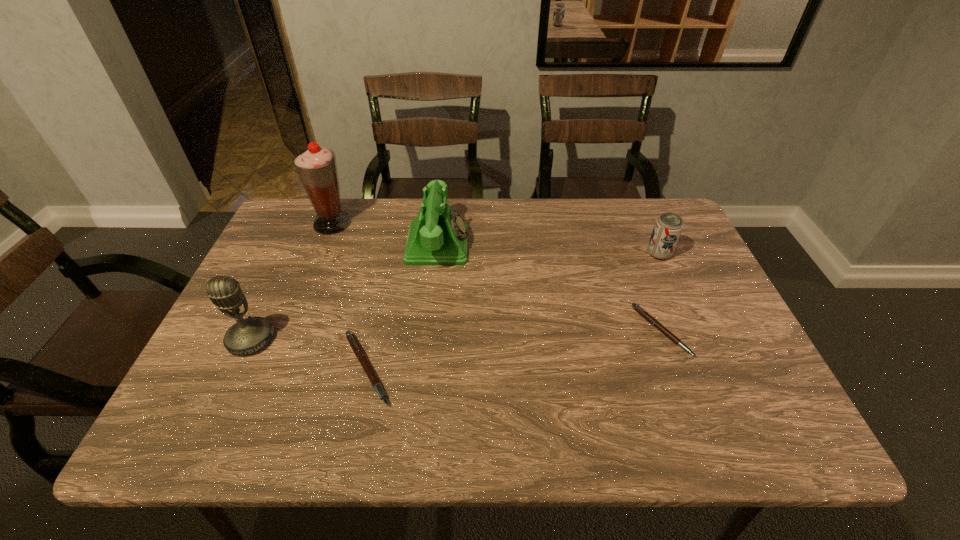
Identify which object is the second nearest to the left pen. Please provide its 2D coordinates. Your answer should be formatted as a tuple, i.e. [(x, y)], where the tuple contains the x and y coordinates of a point satisfying the conditions above.

[(437, 236)]

At what (x,y) coordinates should I click in order to perform the action: click on vacant position in the image that satisfies the following two spatial constraints: 1. on the dial of the telephone; 2. on the front-facing side of the microphone. Please return your answer as a coordinate pair (x, y). This screenshot has width=960, height=540. Looking at the image, I should click on (428, 340).

Identify the location of free location that satisfies the following two spatial constraints: 1. on the front side of the beer can; 2. at the nib of the second shortest object. This screenshot has height=540, width=960. (709, 369).

This screenshot has width=960, height=540. Find the location of `free space that satisfies the following two spatial constraints: 1. on the dial of the telephone; 2. on the front-facing side of the microphone`. free space that satisfies the following two spatial constraints: 1. on the dial of the telephone; 2. on the front-facing side of the microphone is located at coordinates (428, 340).

Locate an element on the screen. vacant space that satisfies the following two spatial constraints: 1. on the dial of the third tallest object; 2. on the right side of the beer can is located at coordinates (437, 254).

You are a GUI agent. You are given a task and a screenshot of the screen. Output one action in this format:
    pyautogui.click(x=<x>, y=<y>)
    Task: Click on the vacant space that satisfies the following two spatial constraints: 1. on the dial of the telephone; 2. on the front-facing side of the microphone
    The image size is (960, 540).
    Given the screenshot: What is the action you would take?
    pyautogui.click(x=428, y=340)